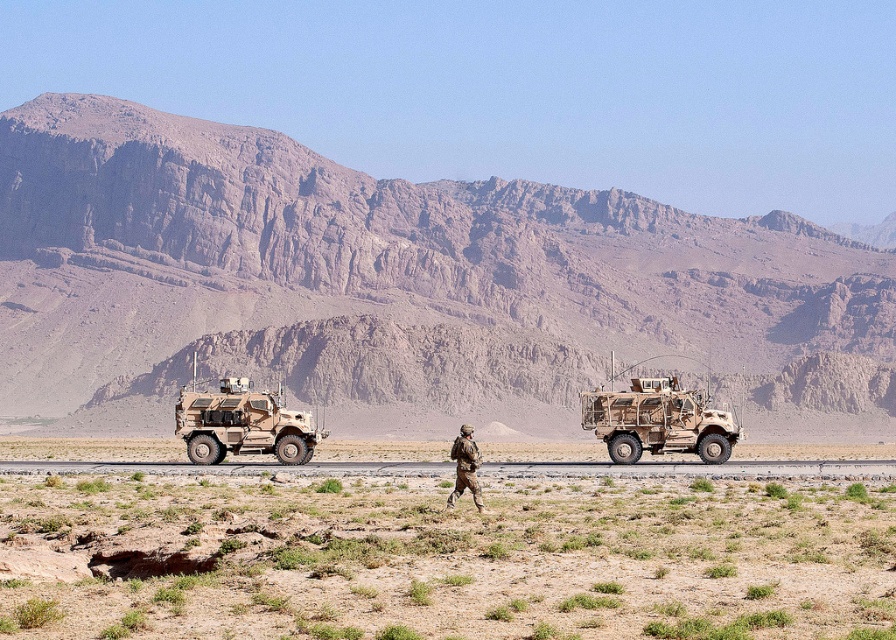
You are a soldier in the desert. You need to determine if your camouflage fabric uniform at center can fit into the back of the camouflage fabric armored vehicle at center. Based on their sizes, can it fit?

The camouflage fabric armored vehicle at center is wider than the camouflage fabric uniform at center, so yes, the uniform can fit into the back of the armored vehicle.

From the picture: You are a soldier in the desert, and you need to decide which item is bigger between the camouflage fabric armored vehicle at center and the camouflage fabric uniform at center. Which one is larger?

The camouflage fabric armored vehicle at center is larger than the camouflage fabric uniform at center.

You are a drone operator controlling a drone that needs to fly from the soldier to the camouflage fabric armored vehicle at center. What is the 2D coordinate of the target location where you should direct the drone to land?

The 2D coordinate of the camouflage fabric armored vehicle at center is at point (242,424), so the drone should be directed to land at that coordinate.